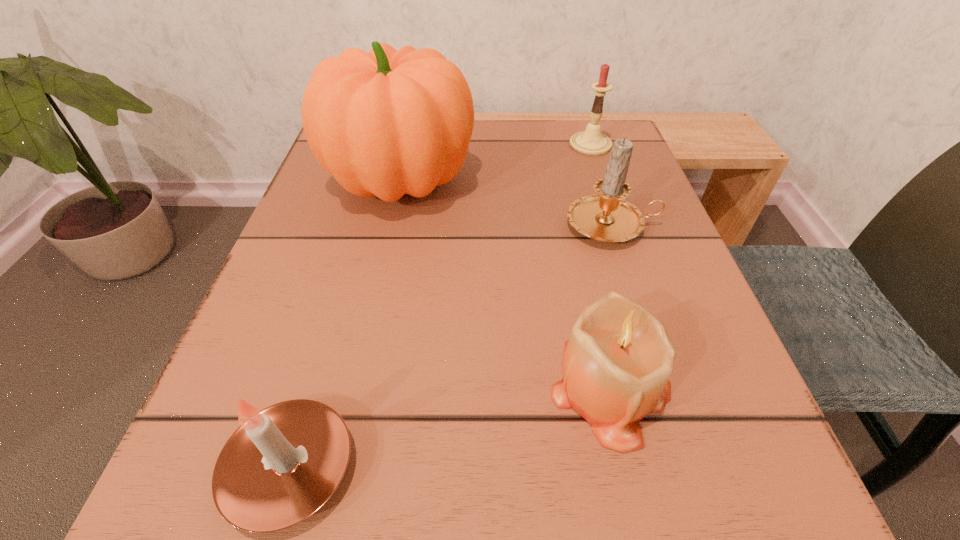
The width and height of the screenshot is (960, 540). In order to click on object located at the far right corner in this screenshot , I will do `click(591, 142)`.

The image size is (960, 540). In order to click on vacant space at the far edge of the desktop in this screenshot , I will do `click(471, 151)`.

Identify the location of free point at the near edge. This screenshot has width=960, height=540. (534, 474).

Where is `blank space at the left edge`? blank space at the left edge is located at coordinates (265, 315).

Find the location of a particular element. vacant space at the right edge of the desktop is located at coordinates (566, 204).

Where is `vacant space at the far right corner`? The height and width of the screenshot is (540, 960). vacant space at the far right corner is located at coordinates (597, 173).

Locate an element on the screen. The width and height of the screenshot is (960, 540). vacant space at the near right corner of the desktop is located at coordinates (775, 519).

Locate an element on the screen. The height and width of the screenshot is (540, 960). unoccupied area between the third nearest candle and the tallest object is located at coordinates (506, 204).

I want to click on vacant point located between the second farthest candle and the pumpkin, so click(506, 204).

Identify which object is located as the second nearest to the leftmost candle. Please provide its 2D coordinates. Your answer should be formatted as a tuple, i.e. [(x, y)], where the tuple contains the x and y coordinates of a point satisfying the conditions above.

[(386, 123)]